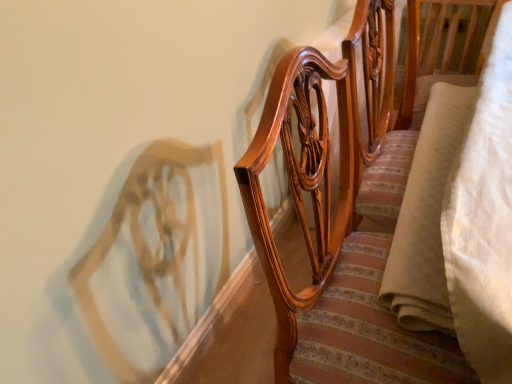
What are the coordinates of `beige suede blanket at right` in the screenshot? It's located at (426, 215).

The height and width of the screenshot is (384, 512). What do you see at coordinates (426, 215) in the screenshot?
I see `beige suede blanket at right` at bounding box center [426, 215].

What do you see at coordinates (340, 228) in the screenshot? This screenshot has width=512, height=384. I see `glossy wood chair at upper center` at bounding box center [340, 228].

Locate an element on the screen. glossy wood chair at upper center is located at coordinates (340, 228).

I want to click on beige suede blanket at right, so click(426, 215).

Which is more to the right, beige suede blanket at right or glossy wood chair at upper center?

From the viewer's perspective, beige suede blanket at right appears more on the right side.

Which object is further away from the camera, beige suede blanket at right or glossy wood chair at upper center?

beige suede blanket at right is further from the camera.

Does point (448, 304) appear closer or farther from the camera than point (345, 285)?

Point (448, 304) appears to be closer to the viewer than point (345, 285).

Based on the photo, from the image's perspective, is beige suede blanket at right below glossy wood chair at upper center?

No.

From a real-world perspective, is beige suede blanket at right positioned above or below glossy wood chair at upper center?

beige suede blanket at right is above glossy wood chair at upper center.

From the picture: Which object is wider, beige suede blanket at right or glossy wood chair at upper center?

glossy wood chair at upper center is wider.

Does beige suede blanket at right have a lesser height compared to glossy wood chair at upper center?

Correct, beige suede blanket at right is not as tall as glossy wood chair at upper center.

Who is bigger, beige suede blanket at right or glossy wood chair at upper center?

Bigger between the two is glossy wood chair at upper center.

Can glossy wood chair at upper center be found inside beige suede blanket at right?

No, glossy wood chair at upper center is located outside of beige suede blanket at right.

From the picture: Is there a large distance between beige suede blanket at right and glossy wood chair at upper center?

No.

Is beige suede blanket at right oriented away from glossy wood chair at upper center?

Correct, beige suede blanket at right is looking away from glossy wood chair at upper center.

Find the location of a particular element. furniture in front of the beige suede blanket at right is located at coordinates (340, 228).

Is glossy wood chair at upper center to the left or to the right of beige suede blanket at right in the image?

From the image, it's evident that glossy wood chair at upper center is to the left of beige suede blanket at right.

Which object is more forward, glossy wood chair at upper center or beige suede blanket at right?

glossy wood chair at upper center is closer to the camera.

Between point (253, 237) and point (395, 239), which one is positioned behind?

The point (253, 237) is farther from the camera.

From the image's perspective, is glossy wood chair at upper center positioned above or below beige suede blanket at right?

From the image's perspective, glossy wood chair at upper center appears below beige suede blanket at right.

From a real-world perspective, does glossy wood chair at upper center stand above beige suede blanket at right?

Incorrect, from a real-world perspective, glossy wood chair at upper center is lower than beige suede blanket at right.

Does glossy wood chair at upper center have a lesser width compared to beige suede blanket at right?

No, glossy wood chair at upper center is not thinner than beige suede blanket at right.

Is glossy wood chair at upper center shorter than beige suede blanket at right?

No.

Does glossy wood chair at upper center have a larger size compared to beige suede blanket at right?

Correct, glossy wood chair at upper center is larger in size than beige suede blanket at right.

From the picture: Would you say glossy wood chair at upper center is outside beige suede blanket at right?

That's correct, glossy wood chair at upper center is outside of beige suede blanket at right.

Are glossy wood chair at upper center and beige suede blanket at right located far from each other?

glossy wood chair at upper center is near beige suede blanket at right, not far away.

Is glossy wood chair at upper center oriented away from beige suede blanket at right?

glossy wood chair at upper center does not have its back to beige suede blanket at right.

How much distance is there between glossy wood chair at upper center and beige suede blanket at right?

They are 7.05 inches apart.

Identify the location of fabric on the right of glossy wood chair at upper center. The width and height of the screenshot is (512, 384). (426, 215).

Locate an element on the screen. This screenshot has width=512, height=384. furniture below the beige suede blanket at right (from a real-world perspective) is located at coordinates (340, 228).

Identify the location of fabric positioned vertically above the glossy wood chair at upper center (from a real-world perspective). (426, 215).